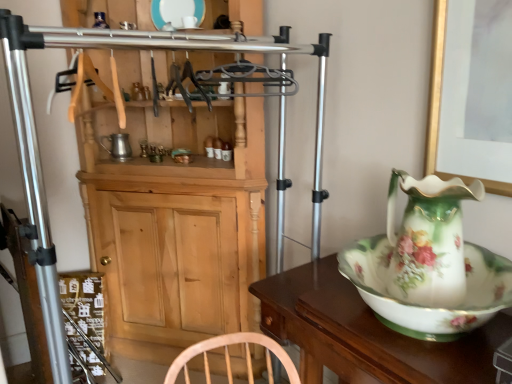
Identify the location of porcelain plate at upper center. The height and width of the screenshot is (384, 512). (176, 12).

Identify the location of porcelain floral jug at right. The image size is (512, 384). (429, 264).

The width and height of the screenshot is (512, 384). Describe the element at coordinates (175, 223) in the screenshot. I see `wooden cabinet at center` at that location.

In order to face white glossy bowl at right, should I rotate leftwards or rightwards?

Rotate your view right by about 15.801°.

At what (x,y) coordinates should I click in order to perform the action: click on porcelain plate at upper center. Please return your answer as a coordinate pair (x, y). The height and width of the screenshot is (384, 512). Looking at the image, I should click on (176, 12).

From a real-world perspective, is porcelain floral jug at right positioned over porcelain plate at upper center based on gravity?

No, from a real-world perspective, porcelain floral jug at right is not on top of porcelain plate at upper center.

Is point (420, 248) farther from camera compared to point (198, 11)?

No.

From the image's perspective, which one is positioned lower, porcelain floral jug at right or porcelain plate at upper center?

From the image's view, porcelain floral jug at right is below.

Which is more to the right, porcelain floral jug at right or porcelain plate at upper center?

porcelain floral jug at right is more to the right.

Is porcelain plate at upper center at the left side of porcelain floral jug at right?

Indeed, porcelain plate at upper center is positioned on the left side of porcelain floral jug at right.

Considering the sizes of objects porcelain plate at upper center and porcelain floral jug at right in the image provided, who is wider, porcelain plate at upper center or porcelain floral jug at right?

porcelain floral jug at right is wider.

From a real-world perspective, between porcelain plate at upper center and porcelain floral jug at right, who is vertically lower?

In real-world perspective, porcelain floral jug at right is lower.

How different are the orientations of porcelain plate at upper center and porcelain floral jug at right in degrees?

The facing directions of porcelain plate at upper center and porcelain floral jug at right are 38.1 degrees apart.

Relative to porcelain floral jug at right, is wooden cabinet at center in front or behind?

Clearly, wooden cabinet at center is behind porcelain floral jug at right.

From a real-world perspective, between wooden cabinet at center and porcelain floral jug at right, who is vertically lower?

wooden cabinet at center, from a real-world perspective.

Considering the sizes of wooden cabinet at center and porcelain floral jug at right in the image, is wooden cabinet at center taller or shorter than porcelain floral jug at right?

In the image, wooden cabinet at center appears to be taller than porcelain floral jug at right.

From the image's perspective, is wooden cabinet at center on top of porcelain floral jug at right?

Yes.

Is white glossy bowl at right far away from porcelain plate at upper center?

Yes, white glossy bowl at right and porcelain plate at upper center are located far from each other.

Considering the relative positions of white glossy bowl at right and porcelain plate at upper center in the image provided, is white glossy bowl at right to the right of porcelain plate at upper center from the viewer's perspective?

Indeed, white glossy bowl at right is positioned on the right side of porcelain plate at upper center.

Is white glossy bowl at right smaller than porcelain plate at upper center?

No.

Is porcelain floral jug at right taller than white glossy bowl at right?

Incorrect, the height of porcelain floral jug at right is not larger of that of white glossy bowl at right.

Which is more to the left, porcelain floral jug at right or white glossy bowl at right?

Positioned to the left is white glossy bowl at right.

Is point (506, 281) positioned after point (295, 301)?

No.

Which object is closer to the camera taking this photo, porcelain floral jug at right or white glossy bowl at right?

white glossy bowl at right is in front.

Considering the relative sizes of white glossy bowl at right and porcelain floral jug at right in the image provided, is white glossy bowl at right wider than porcelain floral jug at right?

Yes, white glossy bowl at right is wider than porcelain floral jug at right.

From the picture: Could you tell me if white glossy bowl at right is turned towards porcelain floral jug at right?

No, white glossy bowl at right is not turned towards porcelain floral jug at right.

Between point (311, 309) and point (449, 297), which one is positioned behind?

The point (311, 309) is behind.

Who is shorter, white glossy bowl at right or porcelain floral jug at right?

porcelain floral jug at right.

Does point (163, 1) come farther from viewer compared to point (255, 278)?

Yes.

Looking at this image, can you tell me how much porcelain plate at upper center and wooden cabinet at center differ in facing direction?

They differ by 6.67e-05 degrees in their facing directions.

Which of these two, porcelain plate at upper center or wooden cabinet at center, is wider?

wooden cabinet at center is wider.

From the image's perspective, which object appears higher, porcelain plate at upper center or wooden cabinet at center?

porcelain plate at upper center is shown above in the image.

The width and height of the screenshot is (512, 384). Find the location of `jug in front of the porcelain plate at upper center`. jug in front of the porcelain plate at upper center is located at coordinates (429, 264).

Find the location of a particular element. plate above the porcelain floral jug at right (from the image's perspective) is located at coordinates (176, 12).

Estimate the real-world distances between objects in this image. Which object is closer to porcelain floral jug at right, porcelain plate at upper center or white glossy bowl at right?

white glossy bowl at right is positioned closer to the anchor porcelain floral jug at right.

Considering their positions, is wooden cabinet at center positioned closer to white glossy bowl at right than porcelain plate at upper center?

wooden cabinet at center lies closer to white glossy bowl at right than the other object.

Based on their spatial positions, is porcelain floral jug at right or white glossy bowl at right further from wooden cabinet at center?

porcelain floral jug at right is further to wooden cabinet at center.

Based on their spatial positions, is white glossy bowl at right or porcelain plate at upper center further from porcelain floral jug at right?

porcelain plate at upper center lies further to porcelain floral jug at right than the other object.

Which object lies further to the anchor point porcelain floral jug at right, wooden cabinet at center or porcelain plate at upper center?

porcelain plate at upper center is further to porcelain floral jug at right.

From the image, which object appears to be nearer to wooden cabinet at center, porcelain plate at upper center or porcelain floral jug at right?

Based on the image, porcelain plate at upper center appears to be nearer to wooden cabinet at center.

From the image, which object appears to be farther from porcelain floral jug at right, wooden cabinet at center or white glossy bowl at right?

The object further to porcelain floral jug at right is wooden cabinet at center.

Based on their spatial positions, is porcelain floral jug at right or porcelain plate at upper center closer to white glossy bowl at right?

The object closer to white glossy bowl at right is porcelain floral jug at right.

Locate an element on the screen. cabinetry between porcelain plate at upper center and white glossy bowl at right vertically is located at coordinates (175, 223).

Locate an element on the screen. This screenshot has width=512, height=384. table between wooden cabinet at center and porcelain floral jug at right in the horizontal direction is located at coordinates (364, 333).

Where is `jug between porcelain plate at upper center and white glossy bowl at right in the up-down direction`? jug between porcelain plate at upper center and white glossy bowl at right in the up-down direction is located at coordinates (429, 264).

Where is `cabinetry that lies between porcelain plate at upper center and porcelain floral jug at right from top to bottom`? cabinetry that lies between porcelain plate at upper center and porcelain floral jug at right from top to bottom is located at coordinates (175, 223).